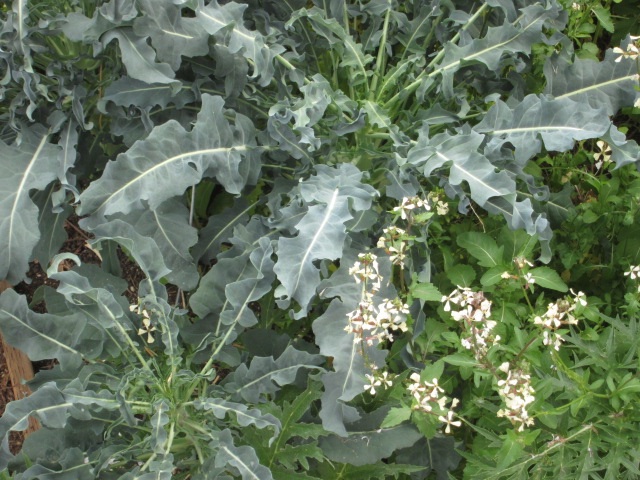
At what (x,y) coordinates should I click in order to perform the action: click on white flower on the left. Please return your answer as a coordinate pair (x, y). This screenshot has width=640, height=480. Looking at the image, I should click on (146, 329), (134, 305).